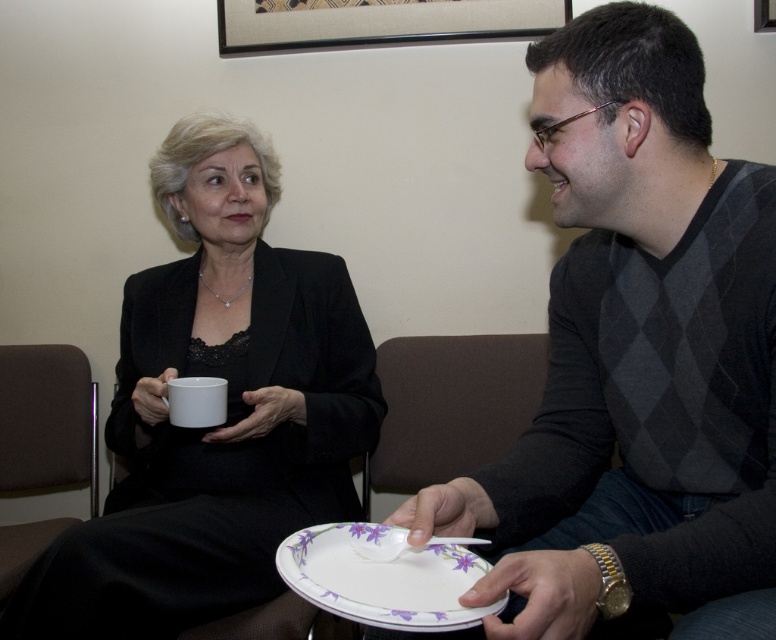
You are a delivery robot with a 10 inch wide package. You need to pass between the matte black suit at center and the white matte mug at center to reach the delivery point. Can you fit through the space between them?

The distance between the matte black suit at center and the white matte mug at center is 8.62 inches. Since the package is 10 inches wide, it is wider than the available space. Therefore, the robot cannot fit through the space between them.

You are a photographer setting up for a portrait. You need to ensure that both the matte black suit at center and the white porcelain plate at lower center are clearly visible in the frame. Based on their positions, which object should you focus on first to ensure both are in focus?

The matte black suit at center is to the left of white porcelain plate at lower center. Since the matte black suit is closer to the left edge, focusing on it first would help ensure both objects remain in the frame and in focus as you adjust the camera settings.